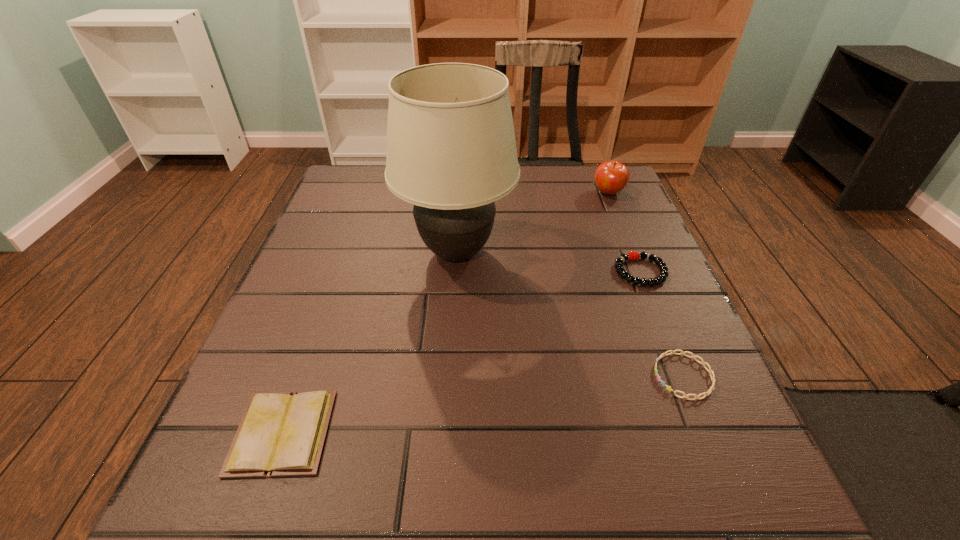
Identify the location of free space located 0.220m on the back of the farther bracelet. Image resolution: width=960 pixels, height=540 pixels. (612, 202).

Locate an element on the screen. vacant space located 0.330m on the back of the diary is located at coordinates (344, 262).

Locate an element on the screen. free space located on the surface of the shorter bracelet showing star-shaped elements is located at coordinates (571, 376).

I want to click on free space located on the surface of the shorter bracelet showing star-shaped elements, so coord(613,376).

This screenshot has height=540, width=960. I want to click on vacant area located on the surface of the shorter bracelet showing star-shaped elements, so click(523, 376).

Where is `object that is at the far edge`? object that is at the far edge is located at coordinates (611, 177).

I want to click on object present at the near edge, so click(280, 434).

Image resolution: width=960 pixels, height=540 pixels. In order to click on object at the left edge in this screenshot , I will do `click(280, 434)`.

The image size is (960, 540). Find the location of `apple that is at the right edge`. apple that is at the right edge is located at coordinates (611, 177).

At what (x,y) coordinates should I click in order to perform the action: click on object present at the near left corner. Please return your answer as a coordinate pair (x, y). This screenshot has width=960, height=540. Looking at the image, I should click on (280, 434).